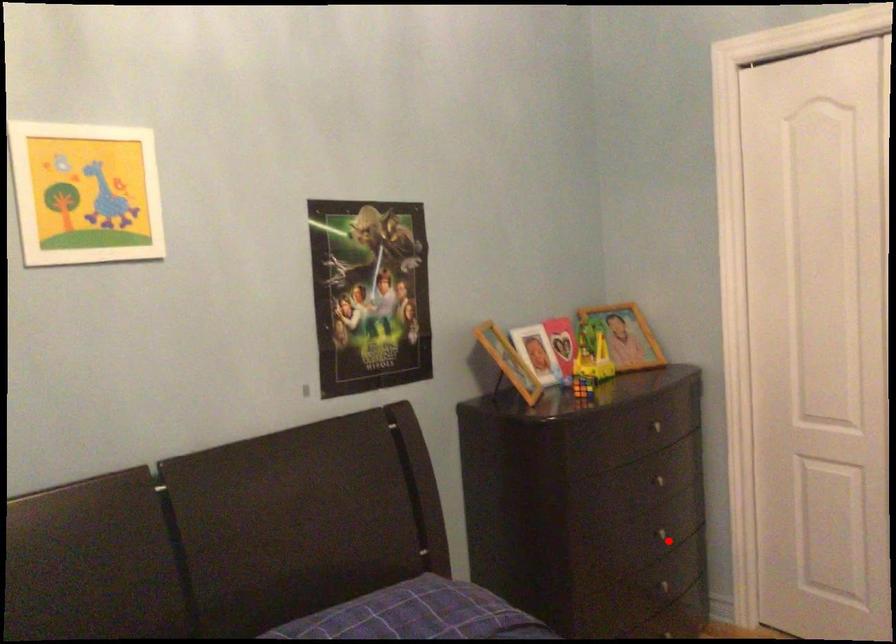
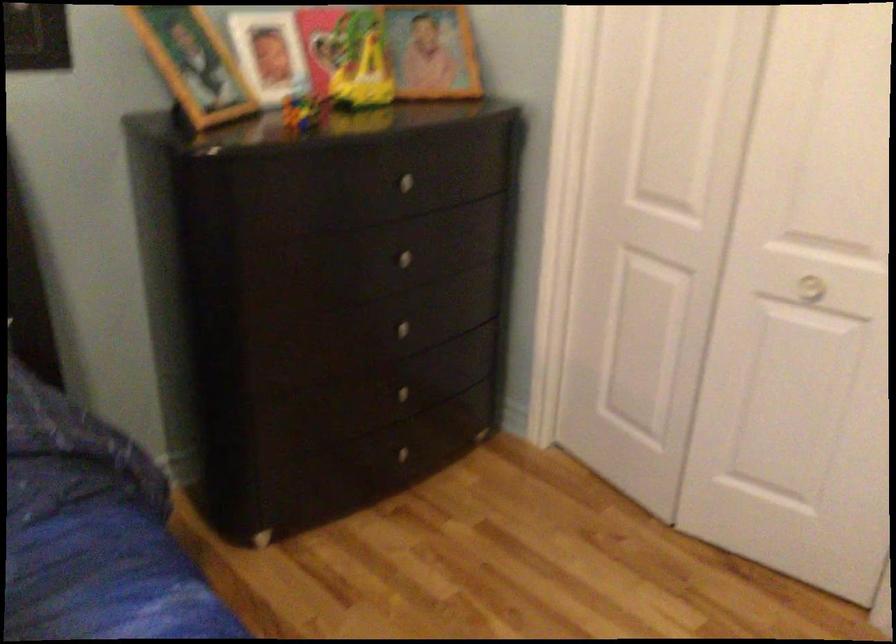
Locate, in the second image, the point that corresponds to the highlighted location in the first image.

(409, 332)